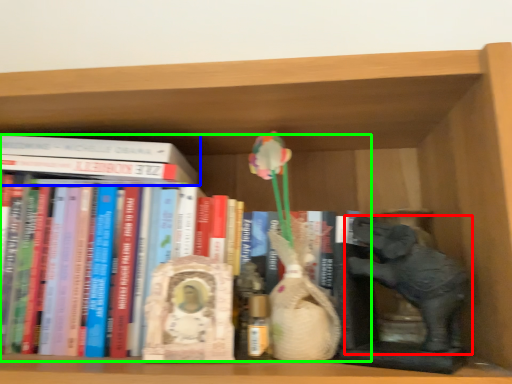
Question: Which is farther away from elephant (highlighted by a red box)? book (highlighted by a blue box) or book (highlighted by a green box)?

Choices:
 (A) book
 (B) book

Answer: (A)